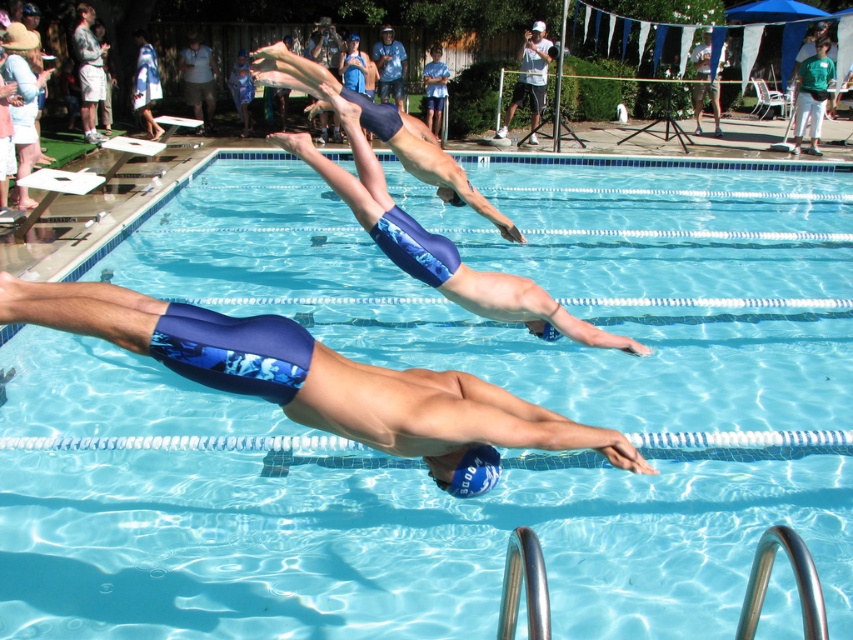
You are a lifeguard standing at the edge of the pool. You need to retrieve the blue fabric towel at upper left and the blue fabric shorts at upper center. If your reach extends 2 meters, can you grab both items without moving from your spot?

The distance between the blue fabric towel at upper left and blue fabric shorts at upper center is 4.27 meters. Since your reach is only 2 meters, you cannot reach both items without moving.

You are a lifeguard standing at the edge of the pool. You see two swimmers wearing blue fabric shorts at center and blue fabric shorts at upper center. If you need to throw a rescue buoy to the swimmer who is farther away from you, which swimmer should you aim for?

The blue fabric shorts at upper center is farther away from you since they are 4.80 meters apart from the blue fabric shorts at center, which is closer.